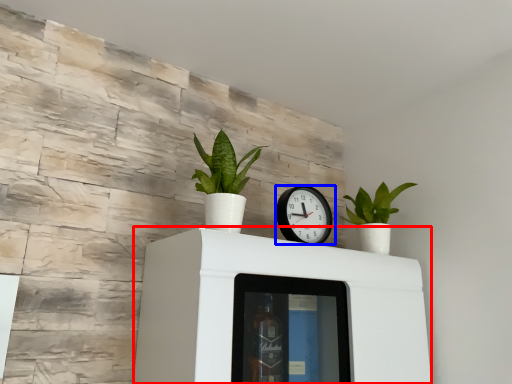
Question: Among these objects, which one is nearest to the camera, furniture (highlighted by a red box) or wall clock (highlighted by a blue box)?

Choices:
 (A) furniture
 (B) wall clock

Answer: (A)